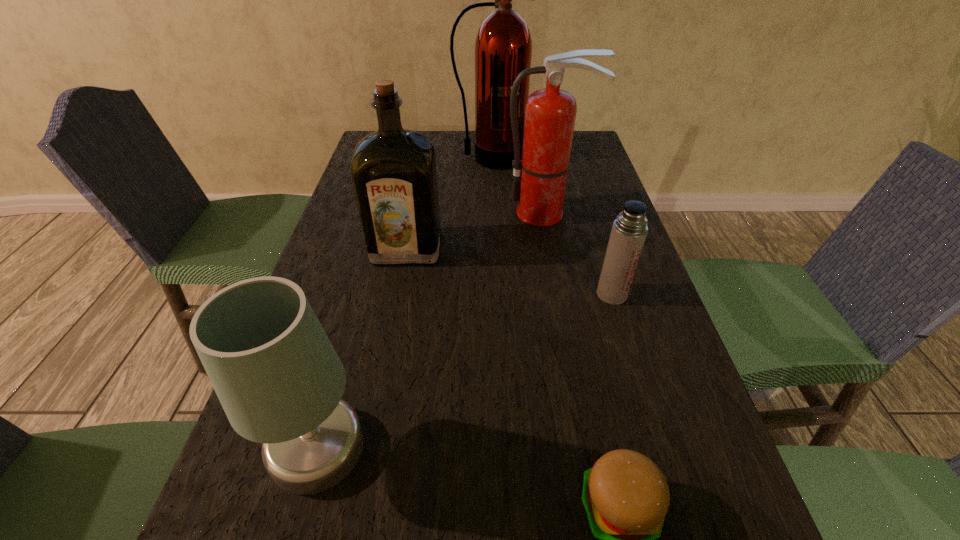
The image size is (960, 540). I want to click on the taller fire extinguisher, so click(x=503, y=47).

This screenshot has width=960, height=540. In order to click on the farther fire extinguisher in this screenshot , I will do `click(503, 47)`.

Locate an element on the screen. the nearer fire extinguisher is located at coordinates tap(540, 177).

The width and height of the screenshot is (960, 540). In order to click on the shorter fire extinguisher in this screenshot , I will do `click(540, 177)`.

Identify the location of the fourth nearest object. (394, 174).

The height and width of the screenshot is (540, 960). In order to click on the fourth tallest object in this screenshot , I will do `click(277, 376)`.

Find the location of a particular element. This screenshot has width=960, height=540. thermos bottle is located at coordinates (629, 231).

You are a GUI agent. You are given a task and a screenshot of the screen. Output one action in this format:
    pyautogui.click(x=<x>, y=<y>)
    Task: Click on the fifth tallest object
    
    Given the screenshot: What is the action you would take?
    pyautogui.click(x=629, y=231)

The height and width of the screenshot is (540, 960). I want to click on vacant space located 0.350m on the front-facing side of the taller fire extinguisher, so click(492, 240).

This screenshot has height=540, width=960. I want to click on vacant space situated 0.070m with the handle and hose on the nearer fire extinguisher, so click(552, 243).